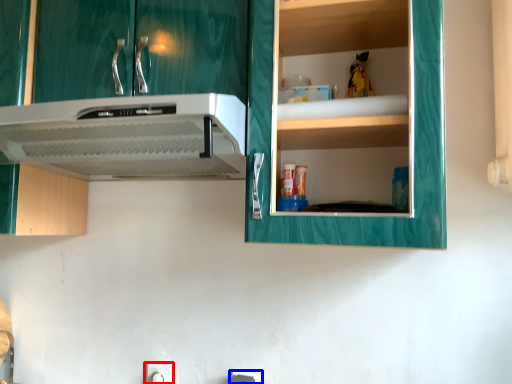
Question: Which point is further to the camera, electric outlet (highlighted by a red box) or electric outlet (highlighted by a blue box)?

Choices:
 (A) electric outlet
 (B) electric outlet

Answer: (A)